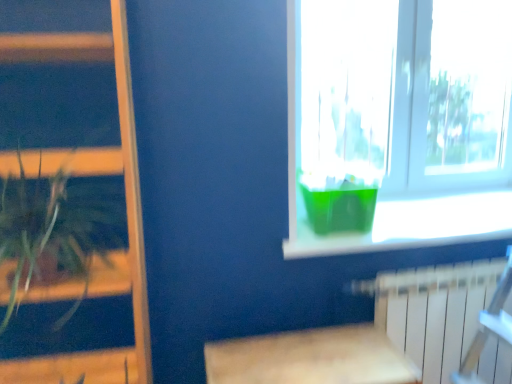
Question: Is transparent plastic container at upper right inside the boundaries of wooden bookshelf at left, or outside?

Choices:
 (A) inside
 (B) outside

Answer: (B)

Question: In the image, is transparent plastic container at upper right positioned in front of or behind wooden bookshelf at left?

Choices:
 (A) behind
 (B) front

Answer: (A)

Question: Which of these objects is positioned closest to the wooden bookshelf at left?

Choices:
 (A) green plastic container at upper right
 (B) green leafy plant at left
 (C) transparent plastic container at upper right
 (D) wooden table at lower center
 (E) green translucent vase at window

Answer: (B)

Question: Which object is the closest to the green plastic container at upper right?

Choices:
 (A) wooden table at lower center
 (B) wooden bookshelf at left
 (C) transparent plastic container at upper right
 (D) green leafy plant at left
 (E) green translucent vase at window

Answer: (E)